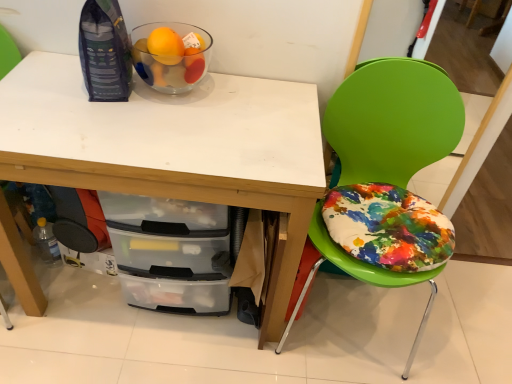
The width and height of the screenshot is (512, 384). Find the location of `free point to the right of transparent glass bowl at upper left`. free point to the right of transparent glass bowl at upper left is located at coordinates (243, 100).